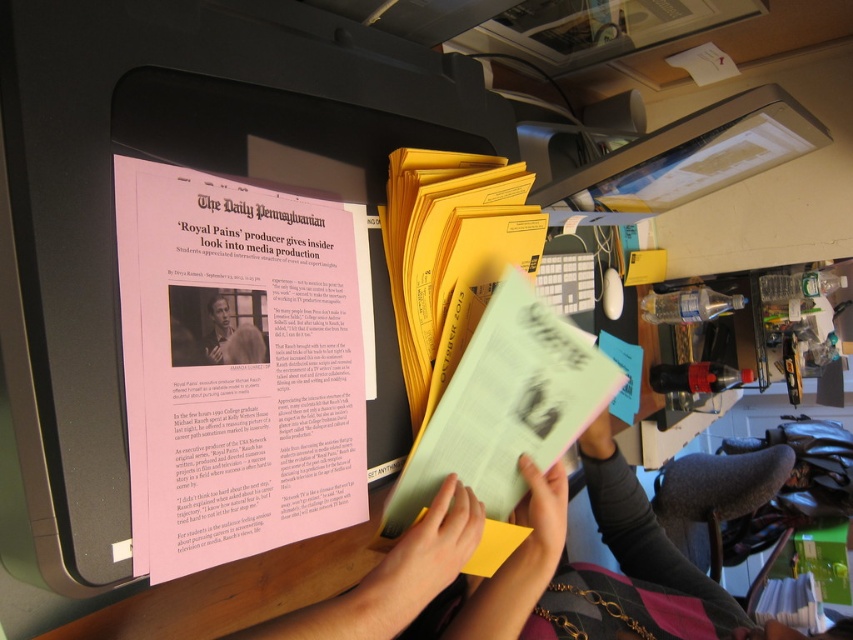
What are the coordinates of the matte black monitor at center?

The coordinates of the matte black monitor at center are at point (173,163).

You are an office worker trying to reach a document located at point (239, 321). There is an obstruction at point (514, 209). Can you reach the document without moving the obstruction?

Point (514, 209) is behind point (239, 321), so you can reach the document at point (239, 321) without moving the obstruction at point (514, 209) because the obstruction is behind it and won

You are organizing papers on a desk and see the pink paper at center and the light green paper at center. Which one is on top?

The pink paper at center is positioned over light green paper at center, so it is on top.